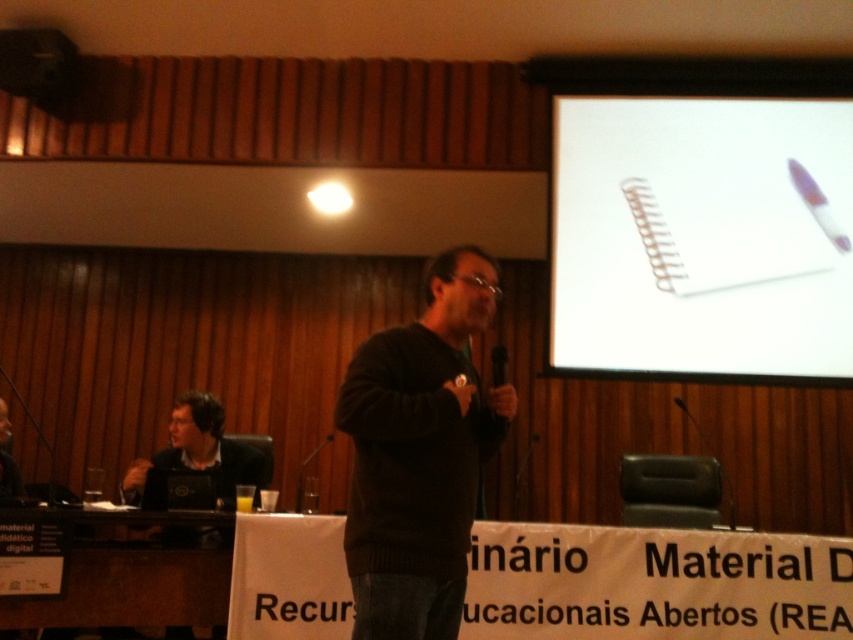
Where is the dark brown sweater at center located in the image?

The dark brown sweater at center is located at point coordinates of 0.711 on the x axis and 0.492 on the y axis.

You are an attendee at this conference and you want to take a photo of the speaker wearing the dark brown sweater at center and the matte black laptop at upper left. However, you want to ensure that both objects are fully visible in the frame. Considering their sizes, is this possible?

The dark brown sweater at center has a greater height compared to the matte black laptop at upper left. Since the sweater is taller, you can adjust your camera angle to capture both the speaker and the laptop in the frame by focusing on the height of the sweater, ensuring the laptop is also visible below it.

Based on the scene described, can you determine the spatial relationship between the two points mentioned? Specifically, is the point at coordinates (659, 307) located behind the point at (131, 497)?

Yes, according to the provided description, the point at coordinates (659, 307) is indeed positioned behind the point at (131, 497).